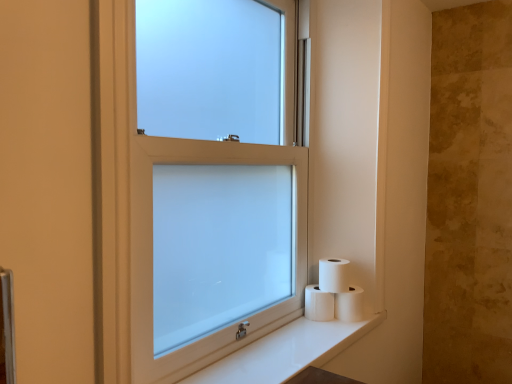
Locate an element on the screen. The width and height of the screenshot is (512, 384). white glossy counter top at lower right is located at coordinates (285, 352).

Identify the location of white matte toilet paper at lower right, which ranks as the 1th toilet paper in right-to-left order. 349,305.

Who is more distant, white matte toilet paper at lower right, which ranks as the second toilet paper in right-to-left order, or white matte toilet paper at lower right, placed as the 3th toilet paper when sorted from left to right?

white matte toilet paper at lower right, placed as the 3th toilet paper when sorted from left to right.

From a real-world perspective, who is located higher, white matte toilet paper at lower right, which is the second toilet paper in left-to-right order, or white matte toilet paper at lower right, which ranks as the 1th toilet paper in right-to-left order?

From a 3D spatial view, white matte toilet paper at lower right, which is the second toilet paper in left-to-right order, is above.

Is white matte toilet paper at lower right, which ranks as the second toilet paper in right-to-left order, wider or thinner than white matte toilet paper at lower right, which ranks as the 1th toilet paper in right-to-left order?

Clearly, white matte toilet paper at lower right, which ranks as the second toilet paper in right-to-left order, has less width compared to white matte toilet paper at lower right, which ranks as the 1th toilet paper in right-to-left order.

Is white matte toilet paper at lower right, placed as the 3th toilet paper when sorted from left to right, located within white matte toilet paper at lower right, which ranks as the second toilet paper in right-to-left order?

Actually, white matte toilet paper at lower right, placed as the 3th toilet paper when sorted from left to right, is outside white matte toilet paper at lower right, which ranks as the second toilet paper in right-to-left order.

Between white matte toilet paper at lower right, which ranks as the second toilet paper in right-to-left order, and white matte toilet paper at lower right, which is the first toilet paper in left-to-right order, which one is positioned in front?

white matte toilet paper at lower right, which ranks as the second toilet paper in right-to-left order, is more forward.

From the image's perspective, is white matte toilet paper at lower right, which is the second toilet paper in left-to-right order, on top of white matte toilet paper at lower right, which appears as the 3th toilet paper when viewed from the right?

Correct, white matte toilet paper at lower right, which is the second toilet paper in left-to-right order, appears higher than white matte toilet paper at lower right, which appears as the 3th toilet paper when viewed from the right, in the image.

Which toilet paper is the 2nd one when counting from the front of the white matte toilet paper at lower right, which is the first toilet paper in left-to-right order? Please provide its 2D coordinates.

[(334, 275)]

Considering the positions of point (322, 264) and point (318, 293), is point (322, 264) closer or farther from the camera than point (318, 293)?

Point (322, 264) is positioned farther from the camera compared to point (318, 293).

Identify the location of counter top below the white frosted glass window at center (from the image's perspective). The width and height of the screenshot is (512, 384). (285, 352).

Considering the sizes of objects white glossy counter top at lower right and white frosted glass window at center in the image provided, who is taller, white glossy counter top at lower right or white frosted glass window at center?

white frosted glass window at center is taller.

Considering the relative positions of white glossy counter top at lower right and white frosted glass window at center in the image provided, is white glossy counter top at lower right to the left or to the right of white frosted glass window at center?

In the image, white glossy counter top at lower right appears on the right side of white frosted glass window at center.

From the image's perspective, which one is positioned lower, white glossy counter top at lower right or white frosted glass window at center?

white glossy counter top at lower right is shown below in the image.

Is white matte toilet paper at lower right, which is the first toilet paper in left-to-right order, looking in the opposite direction of white matte toilet paper at lower right, which ranks as the 1th toilet paper in right-to-left order?

No.

Are white matte toilet paper at lower right, which is the first toilet paper in left-to-right order, and white matte toilet paper at lower right, which ranks as the 1th toilet paper in right-to-left order, far apart?

No, white matte toilet paper at lower right, which is the first toilet paper in left-to-right order, is not far away from white matte toilet paper at lower right, which ranks as the 1th toilet paper in right-to-left order.

Starting from the white matte toilet paper at lower right, which is the first toilet paper in left-to-right order, which toilet paper is the 2nd one to the right? Please provide its 2D coordinates.

[(349, 305)]

Could you tell me if white frosted glass window at center is facing white matte toilet paper at lower right, which ranks as the 1th toilet paper in right-to-left order?

Yes, white frosted glass window at center is turned towards white matte toilet paper at lower right, which ranks as the 1th toilet paper in right-to-left order.

Is white frosted glass window at center inside the boundaries of white matte toilet paper at lower right, placed as the 3th toilet paper when sorted from left to right, or outside?

white frosted glass window at center is located beyond the bounds of white matte toilet paper at lower right, placed as the 3th toilet paper when sorted from left to right.

From a real-world perspective, which object rests below the other?

white matte toilet paper at lower right, placed as the 3th toilet paper when sorted from left to right.

Which is in front, point (342, 295) or point (311, 313)?

The point (311, 313) is more forward.

Considering the relative sizes of white matte toilet paper at lower right, placed as the 3th toilet paper when sorted from left to right, and white matte toilet paper at lower right, which appears as the 3th toilet paper when viewed from the right, in the image provided, is white matte toilet paper at lower right, placed as the 3th toilet paper when sorted from left to right, thinner than white matte toilet paper at lower right, which appears as the 3th toilet paper when viewed from the right,?

In fact, white matte toilet paper at lower right, placed as the 3th toilet paper when sorted from left to right, might be wider than white matte toilet paper at lower right, which appears as the 3th toilet paper when viewed from the right.

Is white matte toilet paper at lower right, which ranks as the 1th toilet paper in right-to-left order, far from white matte toilet paper at lower right, which appears as the 3th toilet paper when viewed from the right?

No.

From the image's perspective, is white glossy counter top at lower right under white matte toilet paper at lower right, which ranks as the second toilet paper in right-to-left order?

Correct, white glossy counter top at lower right appears lower than white matte toilet paper at lower right, which ranks as the second toilet paper in right-to-left order, in the image.

Which is more to the right, white glossy counter top at lower right or white matte toilet paper at lower right, which ranks as the second toilet paper in right-to-left order?

white matte toilet paper at lower right, which ranks as the second toilet paper in right-to-left order, is more to the right.

Which of these two, white glossy counter top at lower right or white matte toilet paper at lower right, which is the second toilet paper in left-to-right order, is thinner?

white matte toilet paper at lower right, which is the second toilet paper in left-to-right order.

From a real-world perspective, which object rests below the other?

From a 3D spatial view, white glossy counter top at lower right is below.

From the white matte toilet paper at lower right, placed as the 3th toilet paper when sorted from left to right, count the 1st toilet paper to the left and point to it. Please provide its 2D coordinates.

[(334, 275)]

At what (x,y) coordinates should I click in order to perform the action: click on the 2nd toilet paper in front of the white matte toilet paper at lower right, which is the first toilet paper in left-to-right order. Please return your answer as a coordinate pair (x, y). Looking at the image, I should click on (334, 275).

Based on their spatial positions, is white matte toilet paper at lower right, placed as the 3th toilet paper when sorted from left to right, or white frosted glass window at center further from white matte toilet paper at lower right, which is the second toilet paper in left-to-right order?

white frosted glass window at center.

Which object lies further to the anchor point white frosted glass window at center, white matte toilet paper at lower right, which appears as the 3th toilet paper when viewed from the right, or white glossy counter top at lower right?

white matte toilet paper at lower right, which appears as the 3th toilet paper when viewed from the right, is positioned further to the anchor white frosted glass window at center.

Which object lies nearer to the anchor point white frosted glass window at center, white matte toilet paper at lower right, which is the first toilet paper in left-to-right order, or white matte toilet paper at lower right, placed as the 3th toilet paper when sorted from left to right?

Among the two, white matte toilet paper at lower right, which is the first toilet paper in left-to-right order, is located nearer to white frosted glass window at center.

Considering their positions, is white matte toilet paper at lower right, placed as the 3th toilet paper when sorted from left to right, positioned further to white matte toilet paper at lower right, which appears as the 3th toilet paper when viewed from the right, than white matte toilet paper at lower right, which ranks as the second toilet paper in right-to-left order?

white matte toilet paper at lower right, which ranks as the second toilet paper in right-to-left order, is positioned further to the anchor white matte toilet paper at lower right, which appears as the 3th toilet paper when viewed from the right.

From the picture: From the image, which object appears to be farther from white frosted glass window at center, white glossy counter top at lower right or white matte toilet paper at lower right, which is the first toilet paper in left-to-right order?

white matte toilet paper at lower right, which is the first toilet paper in left-to-right order, is further to white frosted glass window at center.

From the image, which object appears to be nearer to white glossy counter top at lower right, white matte toilet paper at lower right, which appears as the 3th toilet paper when viewed from the right, or white matte toilet paper at lower right, which ranks as the second toilet paper in right-to-left order?

white matte toilet paper at lower right, which appears as the 3th toilet paper when viewed from the right.

Which object lies nearer to the anchor point white matte toilet paper at lower right, which appears as the 3th toilet paper when viewed from the right, white glossy counter top at lower right or white matte toilet paper at lower right, which ranks as the 1th toilet paper in right-to-left order?

Among the two, white matte toilet paper at lower right, which ranks as the 1th toilet paper in right-to-left order, is located nearer to white matte toilet paper at lower right, which appears as the 3th toilet paper when viewed from the right.

Based on their spatial positions, is white glossy counter top at lower right or white matte toilet paper at lower right, which is the second toilet paper in left-to-right order, closer to white frosted glass window at center?

white glossy counter top at lower right is positioned closer to the anchor white frosted glass window at center.

Locate an element on the screen. toilet paper between white matte toilet paper at lower right, which appears as the 3th toilet paper when viewed from the right, and white matte toilet paper at lower right, which ranks as the 1th toilet paper in right-to-left order is located at coordinates (334, 275).

Find the location of `toilet paper between white glossy counter top at lower right and white matte toilet paper at lower right, which ranks as the 1th toilet paper in right-to-left order, in the front-back direction`. toilet paper between white glossy counter top at lower right and white matte toilet paper at lower right, which ranks as the 1th toilet paper in right-to-left order, in the front-back direction is located at coordinates (334, 275).

Identify the location of counter top positioned between white frosted glass window at center and white matte toilet paper at lower right, which ranks as the second toilet paper in right-to-left order, from near to far. Image resolution: width=512 pixels, height=384 pixels. [x=285, y=352].

Image resolution: width=512 pixels, height=384 pixels. Find the location of `toilet paper between white frosted glass window at center and white matte toilet paper at lower right, placed as the 3th toilet paper when sorted from left to right, along the z-axis`. toilet paper between white frosted glass window at center and white matte toilet paper at lower right, placed as the 3th toilet paper when sorted from left to right, along the z-axis is located at coordinates (334, 275).